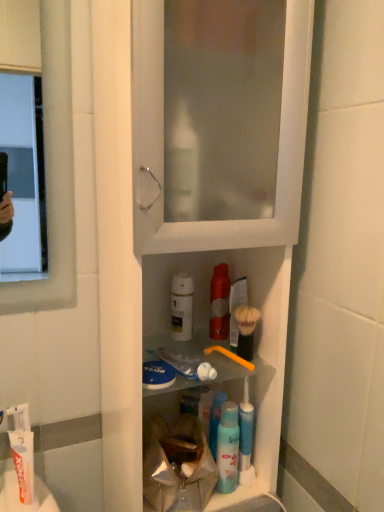
Question: Is yellow plastic toothbrush at center-right wider or thinner than white plastic cabinet at center?

Choices:
 (A) wide
 (B) thin

Answer: (B)

Question: Considering the positions of yellow plastic toothbrush at center-right and white plastic cabinet at center in the image, is yellow plastic toothbrush at center-right bigger or smaller than white plastic cabinet at center?

Choices:
 (A) big
 (B) small

Answer: (B)

Question: Which of these objects is positioned closest to the white plastic cabinet at center?

Choices:
 (A) blue plastic mouthwash at center
 (B) yellow plastic toothbrush at center-right
 (C) white glossy lotion at center
 (D) white matte toothpaste at lower left, the first toothpaste from the bottom
 (E) yellow plastic toothpaste at center, which is the second toothpaste from bottom to top

Answer: (C)

Question: Which object is positioned closest to the blue plastic mouthwash at center?

Choices:
 (A) white plastic cabinet at center
 (B) yellow plastic toothpaste at center, acting as the 2th toothpaste starting from the left
 (C) white matte toothpaste at lower left, the first toothpaste when ordered from left to right
 (D) yellow plastic toothbrush at center-right
 (E) white glossy lotion at center

Answer: (B)